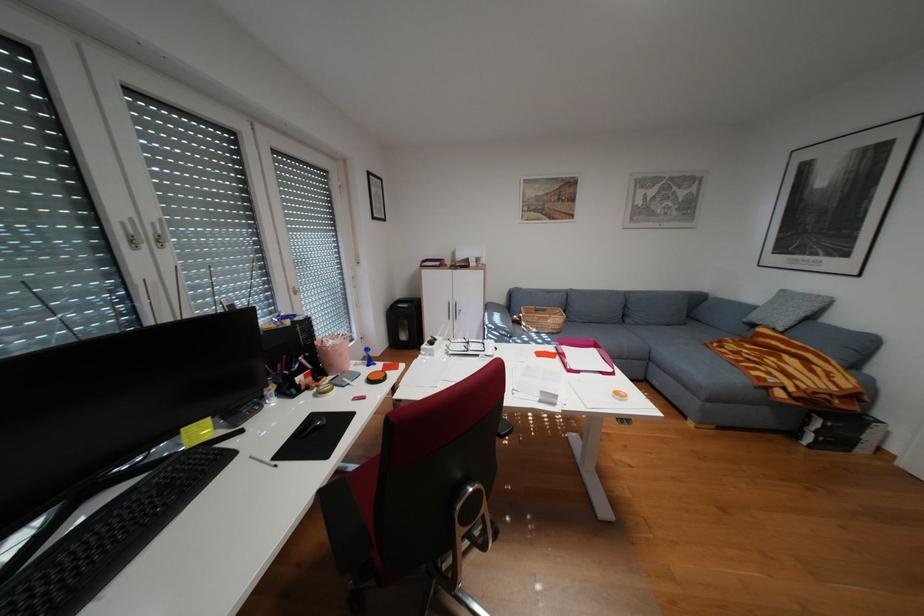
Where is `pair of eyeglasses`? The width and height of the screenshot is (924, 616). pair of eyeglasses is located at coordinates (469, 347).